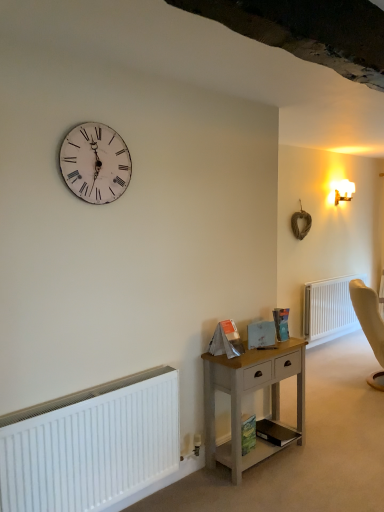
Question: Does white matte radiator at lower left, positioned as the second radiator in back-to-front order, have a lesser height compared to light wood nightstand at lower center?

Choices:
 (A) no
 (B) yes

Answer: (B)

Question: Does white matte radiator at lower left, the first radiator from the left, have a greater height compared to light wood nightstand at lower center?

Choices:
 (A) no
 (B) yes

Answer: (A)

Question: Could you tell me if white matte radiator at lower left, arranged as the first radiator when viewed from the front, is turned towards light wood nightstand at lower center?

Choices:
 (A) yes
 (B) no

Answer: (B)

Question: Is white matte radiator at lower left, the first radiator from the left, further to the viewer compared to light wood nightstand at lower center?

Choices:
 (A) yes
 (B) no

Answer: (B)

Question: Is white matte radiator at lower left, positioned as the second radiator in back-to-front order, at the right side of light wood nightstand at lower center?

Choices:
 (A) yes
 (B) no

Answer: (B)

Question: From a real-world perspective, is light wood nightstand at lower center physically located above or below black matte book at lower center, positioned as the first book in bottom-to-top order?

Choices:
 (A) below
 (B) above

Answer: (B)

Question: Based on their positions, is light wood nightstand at lower center located to the left or right of black matte book at lower center, positioned as the first book in bottom-to-top order?

Choices:
 (A) right
 (B) left

Answer: (B)

Question: Is light wood nightstand at lower center in front of or behind black matte book at lower center, marked as the 3th book in a top-to-bottom arrangement, in the image?

Choices:
 (A) behind
 (B) front

Answer: (B)

Question: From their relative heights in the image, would you say light wood nightstand at lower center is taller or shorter than black matte book at lower center, marked as the 3th book in a top-to-bottom arrangement?

Choices:
 (A) short
 (B) tall

Answer: (B)

Question: Would you say white plastic radiator at lower right, placed as the second radiator when sorted from front to back, is inside or outside black matte book at lower center, marked as the 3th book in a top-to-bottom arrangement?

Choices:
 (A) outside
 (B) inside

Answer: (A)

Question: Considering their positions, is white plastic radiator at lower right, arranged as the first radiator when viewed from the right, located in front of or behind black matte book at lower center, marked as the 3th book in a top-to-bottom arrangement?

Choices:
 (A) front
 (B) behind

Answer: (B)

Question: From a real-world perspective, is white plastic radiator at lower right, placed as the second radiator when sorted from front to back, above or below black matte book at lower center, positioned as the first book in bottom-to-top order?

Choices:
 (A) below
 (B) above

Answer: (B)

Question: Based on their positions, is white plastic radiator at lower right, arranged as the first radiator when viewed from the right, located to the left or right of black matte book at lower center, positioned as the first book in bottom-to-top order?

Choices:
 (A) left
 (B) right

Answer: (B)

Question: From the image's perspective, is hardcover book at center, which is counted as the first book, starting from the top, located above or below white plastic radiator at lower right, arranged as the first radiator when viewed from the right?

Choices:
 (A) below
 (B) above

Answer: (B)

Question: Looking at their shapes, would you say hardcover book at center, the 3th book from the bottom, is wider or thinner than white plastic radiator at lower right, acting as the 2th radiator starting from the left?

Choices:
 (A) wide
 (B) thin

Answer: (B)